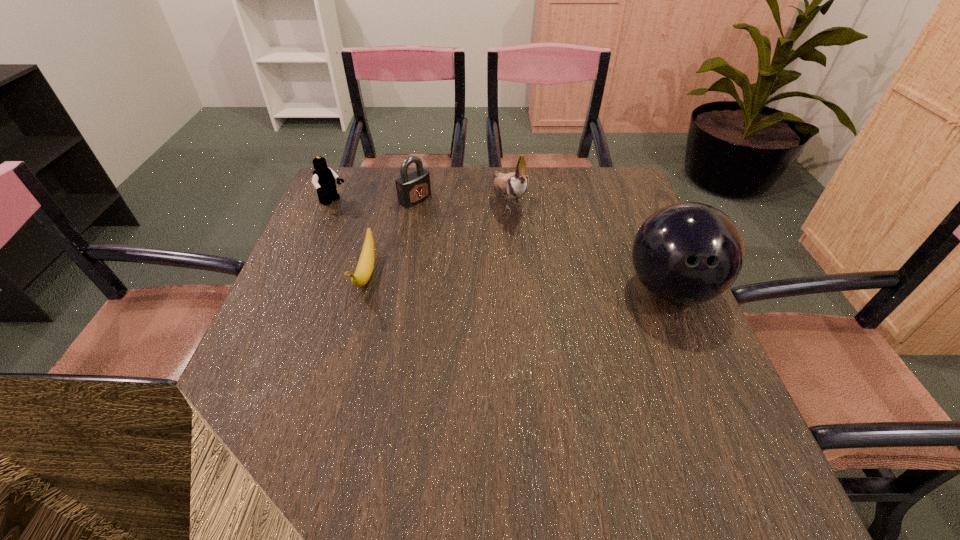
Identify the location of object situated at the left edge. This screenshot has height=540, width=960. (324, 178).

The width and height of the screenshot is (960, 540). I want to click on object that is at the right edge, so click(x=687, y=253).

The image size is (960, 540). I want to click on object positioned at the far left corner, so click(324, 178).

You are a GUI agent. You are given a task and a screenshot of the screen. Output one action in this format:
    pyautogui.click(x=<x>, y=<y>)
    Task: Click on the free region at the far edge of the desktop
    Image resolution: width=960 pixels, height=540 pixels.
    Given the screenshot: What is the action you would take?
    (546, 176)

Locate an element on the screen. The height and width of the screenshot is (540, 960). vacant space at the near edge of the desktop is located at coordinates [x=605, y=408].

In the image, there is a desktop. What are the coordinates of `free region at the left edge` in the screenshot? It's located at (313, 248).

Where is `vacant region at the right edge of the desktop`? The height and width of the screenshot is (540, 960). vacant region at the right edge of the desktop is located at coordinates (646, 329).

In the image, there is a desktop. Where is `vacant area at the far left corner`? vacant area at the far left corner is located at coordinates (376, 198).

The width and height of the screenshot is (960, 540). Identify the location of free space at the far right corner. (604, 209).

This screenshot has height=540, width=960. I want to click on unoccupied position between the padlock and the second object from right to left, so click(x=462, y=199).